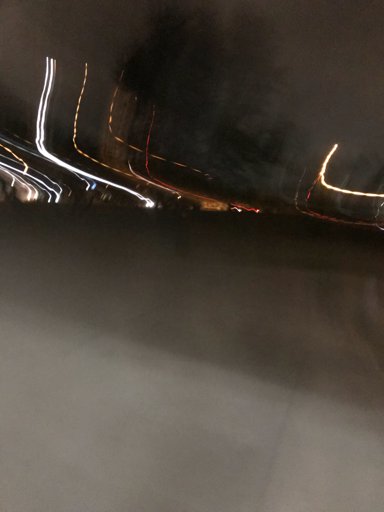
At what (x,y) coordinates should I click in order to perform the action: click on striped lights. Please return your answer as a coordinate pair (x, y). The width and height of the screenshot is (384, 512). Looking at the image, I should click on (111, 167), (121, 139), (14, 154).